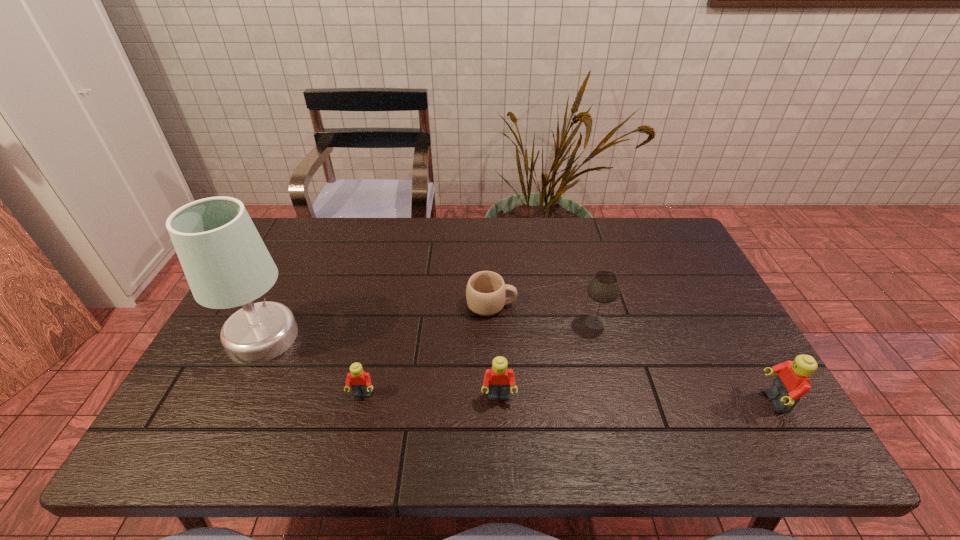
The height and width of the screenshot is (540, 960). What are the coordinates of `free spot that satisfies the following two spatial constraints: 1. on the side of the mug with the handle; 2. on the face of the second shortest object` in the screenshot? It's located at (493, 395).

In order to click on vacant space that satisfies the following two spatial constraints: 1. on the side of the mug with the handle; 2. on the face of the shortest Lego in this screenshot , I will do `click(493, 395)`.

You are a GUI agent. You are given a task and a screenshot of the screen. Output one action in this format:
    pyautogui.click(x=<x>, y=<y>)
    Task: Click on the free spot that satisfies the following two spatial constraints: 1. on the side of the mug with the handle; 2. on the face of the leftmost Lego
    This screenshot has height=540, width=960.
    Given the screenshot: What is the action you would take?
    pyautogui.click(x=493, y=395)

Identify the location of vacant space that satisfies the following two spatial constraints: 1. on the side of the shortest object with the handle; 2. on the right side of the fifth object from left to right. The height and width of the screenshot is (540, 960). (492, 322).